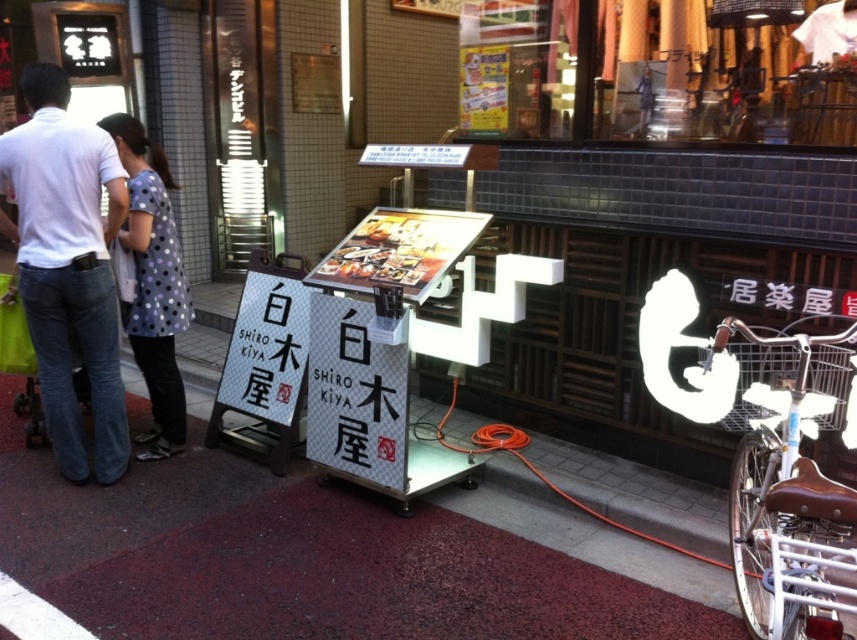
Question: Is white paper sign at center below polka dot fabric dress at center?

Choices:
 (A) no
 (B) yes

Answer: (B)

Question: Based on their relative distances, which object is farther from the white paper sign at center?

Choices:
 (A) maroon carpet at center
 (B) polka dot fabric dress at center
 (C) golden glossy menu at center

Answer: (B)

Question: Among these objects, which one is farthest from the camera?

Choices:
 (A) white paper sign at center
 (B) maroon carpet at center
 (C) polka dot fabric dress at center

Answer: (C)

Question: Considering the relative positions of white cotton shirt at left and polka dot fabric dress at center in the image provided, where is white cotton shirt at left located with respect to polka dot fabric dress at center?

Choices:
 (A) right
 (B) left

Answer: (B)

Question: Is white cotton shirt at left further to the viewer compared to polka dot fabric dress at center?

Choices:
 (A) no
 (B) yes

Answer: (A)

Question: Which point is farther to the camera?

Choices:
 (A) (403, 410)
 (B) (670, 572)

Answer: (A)